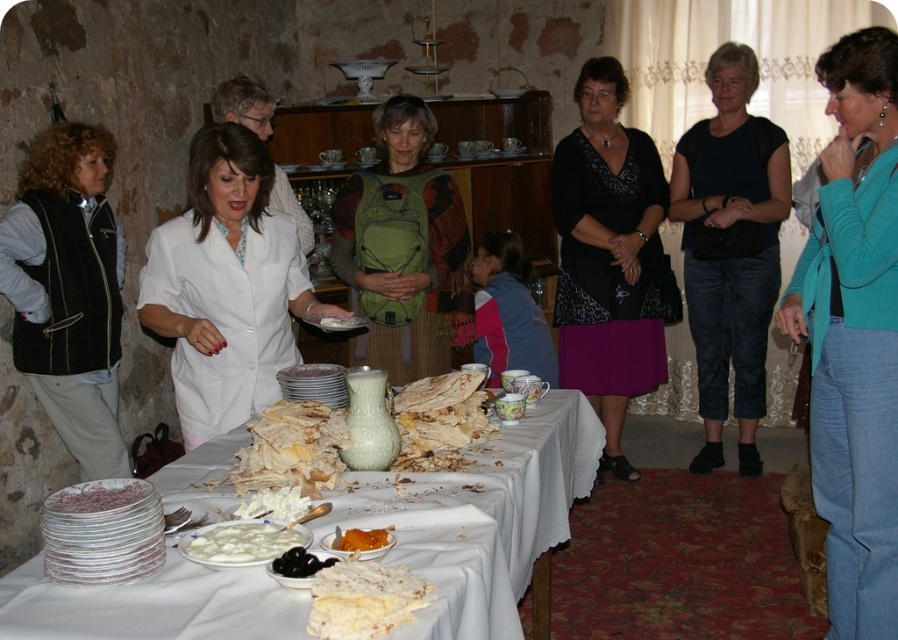
Which is behind, point (726, 180) or point (455, 408)?

The point (726, 180) is behind.

I want to click on black cotton shirt at center, so click(729, 248).

Between point (819, 362) and point (315, 419), which one is positioned behind?

Positioned behind is point (819, 362).

Who is more forward, (x=844, y=490) or (x=251, y=445)?

Point (x=251, y=445)

I want to click on teal sweater at center, so click(854, 333).

This screenshot has width=898, height=640. I want to click on teal sweater at center, so click(854, 333).

Between point (841, 336) and point (509, 346), which one is positioned behind?

Point (509, 346)

This screenshot has width=898, height=640. What do you see at coordinates (854, 333) in the screenshot?
I see `teal sweater at center` at bounding box center [854, 333].

Locate an element on the screen. The image size is (898, 640). teal sweater at center is located at coordinates (854, 333).